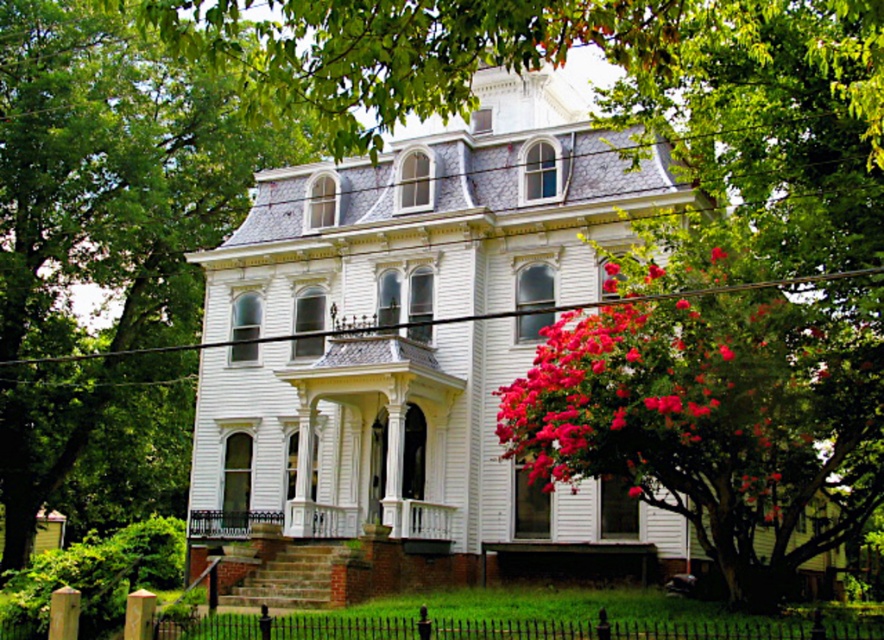
You are standing in front of the Victorian house and notice the vivid pink petals at right and the white painted wood porch at center. Which object is positioned to the right side of the other?

The vivid pink petals at right are to the right of the white painted wood porch at center.

You are standing at the base of the house and want to take a photo of the point located at coordinates point (x=741, y=400). Given that the camera you are using has a maximum focus range of 150 feet, will the camera be able to focus on that point?

The point (x=741, y=400) is 166.14 feet away from the camera, which exceeds the maximum focus range of 150 feet. Therefore, the camera will not be able to focus on that point.

You are standing at the base of the steps leading to the Victorian house. You want to take a photo of both the green leafy tree at upper left and the vivid pink petals at right. Which object should you focus on first if you want to capture both in the same frame without moving the camera?

The green leafy tree at upper left should be focused on first because it is larger and more prominent than the vivid pink petals at right, ensuring it fits well within the frame while still capturing the smaller petals in the background.